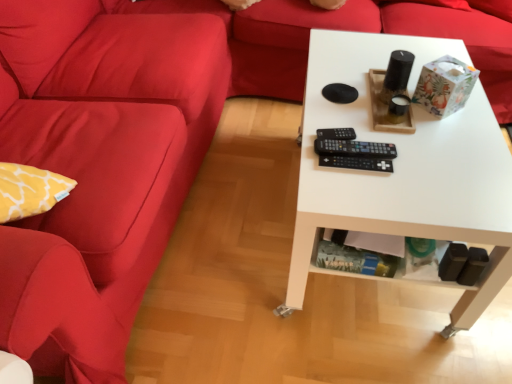
Identify the location of matte red couch at left. Image resolution: width=512 pixels, height=384 pixels. 98,168.

The width and height of the screenshot is (512, 384). I want to click on black plastic remote at center, positioned as the second control in bottom-to-top order, so click(x=354, y=148).

This screenshot has width=512, height=384. Describe the element at coordinates (404, 168) in the screenshot. I see `white matte table at center` at that location.

Measure the distance between point (x=345, y=130) and camera.

They are 3.81 feet apart.

Locate an element on the screen. The height and width of the screenshot is (384, 512). black plastic remote at center, acting as the 1th control starting from the top is located at coordinates (336, 134).

In order to click on matte red couch at left in this screenshot , I will do pyautogui.click(x=98, y=168).

Would you say black plastic remote at center, arranged as the second control when viewed from the top, contains velvet red couch at left?

No, velvet red couch at left is not inside black plastic remote at center, arranged as the second control when viewed from the top.

Between black plastic remote at center, positioned as the second control in bottom-to-top order, and velvet red couch at left, which one has larger size?

velvet red couch at left is bigger.

From the image's perspective, would you say black plastic remote at center, positioned as the second control in bottom-to-top order, is positioned over velvet red couch at left?

Incorrect, from the image's perspective, black plastic remote at center, positioned as the second control in bottom-to-top order, is lower than velvet red couch at left.

I want to click on control that is the 3rd object above the velvet red couch at left (from a real-world perspective), so coord(354,148).

Is black plastic remote at center, arranged as the second control when viewed from the top, completely or partially outside of black plastic remote at center, the 3th control in the bottom-to-top sequence?

Yes, black plastic remote at center, arranged as the second control when viewed from the top, is outside of black plastic remote at center, the 3th control in the bottom-to-top sequence.

Considering the positions of objects black plastic remote at center, positioned as the second control in bottom-to-top order, and black plastic remote at center, acting as the 1th control starting from the top, in the image provided, who is more to the left, black plastic remote at center, positioned as the second control in bottom-to-top order, or black plastic remote at center, acting as the 1th control starting from the top,?

Positioned to the left is black plastic remote at center, acting as the 1th control starting from the top.

Would you consider black plastic remote at center, positioned as the second control in bottom-to-top order, to be distant from black plastic remote at center, the 3th control in the bottom-to-top sequence?

No, there isn't a large distance between black plastic remote at center, positioned as the second control in bottom-to-top order, and black plastic remote at center, the 3th control in the bottom-to-top sequence.

Which of these two, black plastic remote at center, arranged as the second control when viewed from the top, or black plastic remote at center, acting as the 1th control starting from the top, stands shorter?

With less height is black plastic remote at center, acting as the 1th control starting from the top.

From the image's perspective, is black plastic remote at center, acting as the 1th control starting from the top, located above or below black plastic remote at center, arranged as the second control when viewed from the top?

Based on their image positions, black plastic remote at center, acting as the 1th control starting from the top, is located above black plastic remote at center, arranged as the second control when viewed from the top.

Which of these two, black plastic remote at center, acting as the 1th control starting from the top, or black plastic remote at center, positioned as the second control in bottom-to-top order, stands shorter?

Standing shorter between the two is black plastic remote at center, positioned as the second control in bottom-to-top order.

Would you say black plastic remote at center, the 3th control in the bottom-to-top sequence, is inside or outside black plastic remote at center, arranged as the second control when viewed from the top?

black plastic remote at center, the 3th control in the bottom-to-top sequence, cannot be found inside black plastic remote at center, arranged as the second control when viewed from the top.

Does point (187, 118) appear closer or farther from the camera than point (343, 131)?

Point (187, 118).

You are a GUI agent. You are given a task and a screenshot of the screen. Output one action in this format:
    pyautogui.click(x=<x>, y=<y>)
    Task: Click on the studio couch on the left of black plastic remote at center, the 3th control in the bottom-to-top sequence
    The image size is (512, 384).
    Given the screenshot: What is the action you would take?
    pyautogui.click(x=98, y=168)

From a real-world perspective, is matte red couch at left over black plastic remote at center, acting as the 1th control starting from the top?

No.

Considering the sizes of objects matte red couch at left and black plastic remote at center, acting as the 1th control starting from the top, in the image provided, who is shorter, matte red couch at left or black plastic remote at center, acting as the 1th control starting from the top,?

Standing shorter between the two is black plastic remote at center, acting as the 1th control starting from the top.

Is white matte table at center positioned in front of black plastic remote at center, arranged as the second control when viewed from the top?

Yes, it is.

From the image's perspective, is white matte table at center above or below black plastic remote at center, arranged as the second control when viewed from the top?

From the image's perspective, white matte table at center appears below black plastic remote at center, arranged as the second control when viewed from the top.

Is white matte table at center facing towards black plastic remote at center, arranged as the second control when viewed from the top?

No, white matte table at center is not oriented towards black plastic remote at center, arranged as the second control when viewed from the top.

Which is in front, point (454, 334) or point (383, 154)?

The point (383, 154) is closer to the camera.

Is black plastic remote at center, the 1th control when ordered from bottom to top, located outside black plastic remote at center, arranged as the second control when viewed from the top?

Yes, black plastic remote at center, the 1th control when ordered from bottom to top, is outside of black plastic remote at center, arranged as the second control when viewed from the top.

Can you tell me how much black plastic remote at center, which is counted as the third control, starting from the top, and black plastic remote at center, arranged as the second control when viewed from the top, differ in facing direction?

The angular difference between black plastic remote at center, which is counted as the third control, starting from the top, and black plastic remote at center, arranged as the second control when viewed from the top, is 3.26 degrees.

Is point (356, 159) positioned behind point (315, 147)?

That is False.

In terms of size, does black plastic remote at center, which is counted as the third control, starting from the top, appear bigger or smaller than black plastic remote at center, positioned as the second control in bottom-to-top order?

black plastic remote at center, which is counted as the third control, starting from the top, is smaller than black plastic remote at center, positioned as the second control in bottom-to-top order.

Which of these two, velvet red couch at left or black plastic remote at center, positioned as the second control in bottom-to-top order, is wider?

velvet red couch at left is wider.

Which object is positioned more to the right, velvet red couch at left or black plastic remote at center, arranged as the second control when viewed from the top?

velvet red couch at left is more to the right.

How many degrees apart are the facing directions of velvet red couch at left and black plastic remote at center, positioned as the second control in bottom-to-top order?

The angle between the facing direction of velvet red couch at left and the facing direction of black plastic remote at center, positioned as the second control in bottom-to-top order, is 4.85 degrees.

Is velvet red couch at left beside black plastic remote at center, arranged as the second control when viewed from the top?

velvet red couch at left and black plastic remote at center, arranged as the second control when viewed from the top, are clearly separated.

Where is `couch that is behind the black plastic remote at center, arranged as the second control when viewed from the top`? Image resolution: width=512 pixels, height=384 pixels. couch that is behind the black plastic remote at center, arranged as the second control when viewed from the top is located at coordinates (347, 30).

Which control is the 1st one when counting from the front of the black plastic remote at center, the 3th control in the bottom-to-top sequence? Please provide its 2D coordinates.

[(354, 148)]

Based on their spatial positions, is black plastic remote at center, acting as the 1th control starting from the top, or black plastic remote at center, positioned as the second control in bottom-to-top order, closer to black plastic remote at center, which is counted as the third control, starting from the top?

The object closer to black plastic remote at center, which is counted as the third control, starting from the top, is black plastic remote at center, positioned as the second control in bottom-to-top order.

Based on their spatial positions, is black plastic remote at center, acting as the 1th control starting from the top, or white matte table at center further from black plastic remote at center, which is counted as the third control, starting from the top?

white matte table at center.

Looking at the image, which one is located closer to black plastic remote at center, which is counted as the third control, starting from the top, black plastic remote at center, positioned as the second control in bottom-to-top order, or matte red couch at left?

black plastic remote at center, positioned as the second control in bottom-to-top order, is closer to black plastic remote at center, which is counted as the third control, starting from the top.

Considering their positions, is white matte table at center positioned closer to matte red couch at left than black plastic remote at center, positioned as the second control in bottom-to-top order?

white matte table at center.

Estimate the real-world distances between objects in this image. Which object is further from black plastic remote at center, arranged as the second control when viewed from the top, black plastic remote at center, the 3th control in the bottom-to-top sequence, or white matte table at center?

white matte table at center lies further to black plastic remote at center, arranged as the second control when viewed from the top, than the other object.

Based on their spatial positions, is matte red couch at left or black plastic remote at center, acting as the 1th control starting from the top, closer to black plastic remote at center, arranged as the second control when viewed from the top?

Among the two, black plastic remote at center, acting as the 1th control starting from the top, is located nearer to black plastic remote at center, arranged as the second control when viewed from the top.

From the image, which object appears to be nearer to black plastic remote at center, which is counted as the third control, starting from the top, black plastic remote at center, positioned as the second control in bottom-to-top order, or black plastic remote at center, the 3th control in the bottom-to-top sequence?

black plastic remote at center, positioned as the second control in bottom-to-top order, is closer to black plastic remote at center, which is counted as the third control, starting from the top.

Consider the image. Based on their spatial positions, is matte red couch at left or black plastic remote at center, acting as the 1th control starting from the top, further from white matte table at center?

The object further to white matte table at center is matte red couch at left.

Locate an element on the screen. The width and height of the screenshot is (512, 384). control between velvet red couch at left and black plastic remote at center, positioned as the second control in bottom-to-top order, in the vertical direction is located at coordinates (336, 134).

Where is `control between matte red couch at left and black plastic remote at center, the 1th control when ordered from bottom to top, from left to right`? control between matte red couch at left and black plastic remote at center, the 1th control when ordered from bottom to top, from left to right is located at coordinates (336, 134).

Where is `table between velvet red couch at left and black plastic remote at center, the 1th control when ordered from bottom to top, in the vertical direction`? table between velvet red couch at left and black plastic remote at center, the 1th control when ordered from bottom to top, in the vertical direction is located at coordinates (404, 168).

You are a GUI agent. You are given a task and a screenshot of the screen. Output one action in this format:
    pyautogui.click(x=<x>, y=<y>)
    Task: Click on the couch between matte red couch at left and white matte table at center from left to right
    
    Given the screenshot: What is the action you would take?
    pyautogui.click(x=347, y=30)